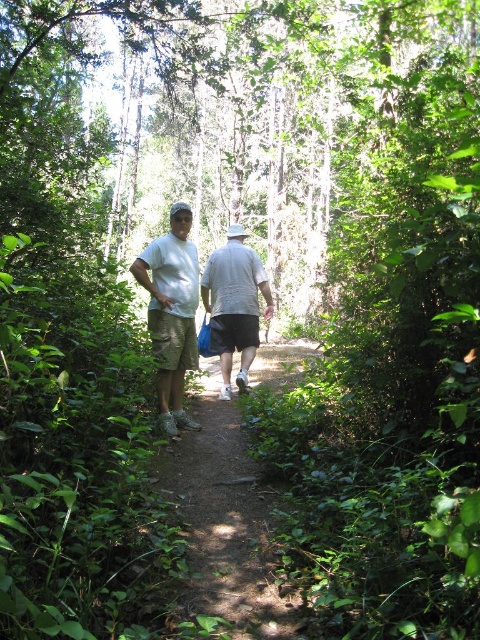
You are planning to walk along the dirt path at center while wearing the gray cotton shirt at center. Considering the width of the path, do you think you might have to walk carefully to avoid the surrounding shrubs?

The dirt path at center is narrower than the gray cotton shirt at center, so you will need to walk carefully to avoid the shrubs on either side of the path.

You are standing at the point labeled point (216, 563) and want to walk to the point labeled point (149, 296). Given that the path is narrow and flanked by dense shrubs, will you have to move forward or backward to reach your destination?

Since point (216, 563) is closer to the viewer than point (149, 296), you will have to move backward to reach your destination.